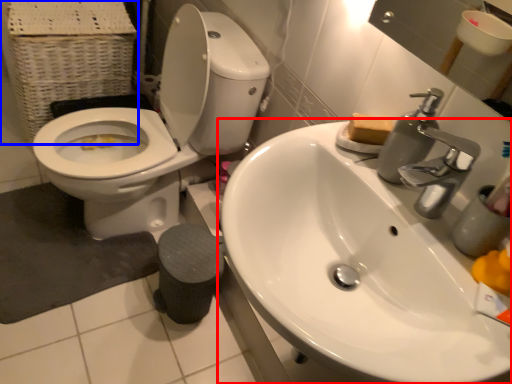
Question: Which of the following is the closest to the observer, sink (highlighted by a red box) or basket (highlighted by a blue box)?

Choices:
 (A) sink
 (B) basket

Answer: (A)